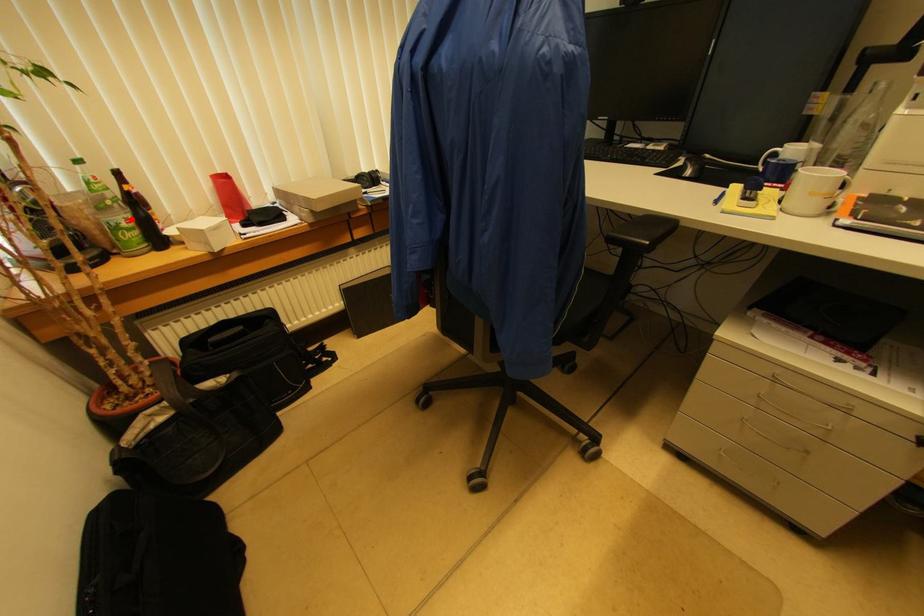
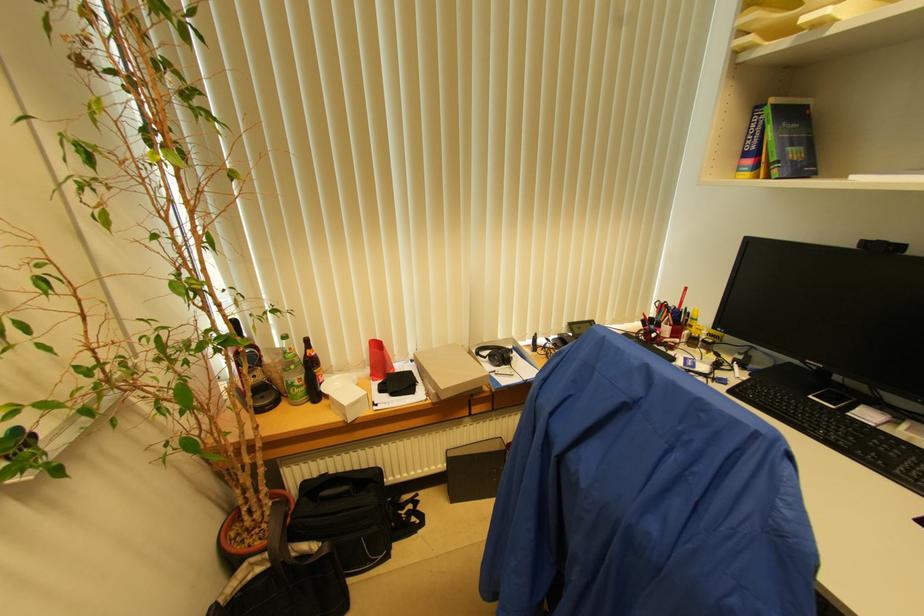
Find the pixel in the second image that matches the highlighted location in the first image.

(304, 379)